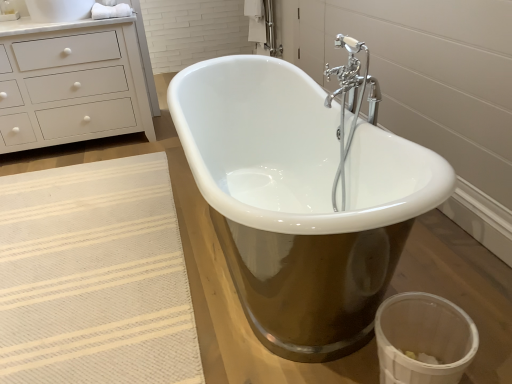
Locate an element on the screen. This screenshot has width=512, height=384. white matte chest of drawers at upper left is located at coordinates (71, 84).

What do you see at coordinates (71, 84) in the screenshot? I see `white matte chest of drawers at upper left` at bounding box center [71, 84].

Find the location of a particular element. white matte chest of drawers at upper left is located at coordinates (71, 84).

Which is more to the left, beige woven rug at lower left or white glossy bathtub at center?

Positioned to the left is beige woven rug at lower left.

Is beige woven rug at lower left positioned before white glossy bathtub at center?

No, beige woven rug at lower left is further to the viewer.

Is beige woven rug at lower left positioned far away from white glossy bathtub at center?

That's not correct — beige woven rug at lower left is a little close to white glossy bathtub at center.

Which is behind, point (366, 338) or point (441, 344)?

Positioned behind is point (366, 338).

The image size is (512, 384). Find the location of `bathtub in front of the transparent plastic toilet bowl at lower right`. bathtub in front of the transparent plastic toilet bowl at lower right is located at coordinates (300, 200).

Is white glossy bathtub at center thinner than transparent plastic toilet bowl at lower right?

Incorrect, the width of white glossy bathtub at center is not less than that of transparent plastic toilet bowl at lower right.

Can you see white glossy bathtub at center touching transparent plastic toilet bowl at lower right?

white glossy bathtub at center is not next to transparent plastic toilet bowl at lower right, and they're not touching.

Who is smaller, transparent plastic toilet bowl at lower right or white cotton towel at upper left?

white cotton towel at upper left.

Considering the sizes of objects transparent plastic toilet bowl at lower right and white cotton towel at upper left in the image provided, who is shorter, transparent plastic toilet bowl at lower right or white cotton towel at upper left?

With less height is white cotton towel at upper left.

Is transparent plastic toilet bowl at lower right turned away from white cotton towel at upper left?

transparent plastic toilet bowl at lower right does not have its back to white cotton towel at upper left.

How distant is white cotton towel at upper left from transparent plastic toilet bowl at lower right?

white cotton towel at upper left is 8.01 feet from transparent plastic toilet bowl at lower right.

Is white cotton towel at upper left aimed at transparent plastic toilet bowl at lower right?

No, white cotton towel at upper left does not turn towards transparent plastic toilet bowl at lower right.

Who is taller, white cotton towel at upper left or transparent plastic toilet bowl at lower right?

transparent plastic toilet bowl at lower right is taller.

How different are the orientations of white cotton towel at upper left and transparent plastic toilet bowl at lower right in degrees?

The angle between the facing direction of white cotton towel at upper left and the facing direction of transparent plastic toilet bowl at lower right is 89.7 degrees.

Would you say white matte chest of drawers at upper left is outside white cotton towel at upper left?

white matte chest of drawers at upper left lies outside white cotton towel at upper left's area.

The image size is (512, 384). I want to click on toilet paper that appears behind the white matte chest of drawers at upper left, so click(110, 11).

How different are the orientations of white matte chest of drawers at upper left and white cotton towel at upper left in degrees?

0.753 degrees.

From the image's perspective, is white matte chest of drawers at upper left located above or below white cotton towel at upper left?

From the image's perspective, white matte chest of drawers at upper left appears below white cotton towel at upper left.

Locate an element on the screen. bathtub that appears on the right of white cotton towel at upper left is located at coordinates (300, 200).

Can we say white cotton towel at upper left lies outside white glossy bathtub at center?

white cotton towel at upper left lies outside white glossy bathtub at center's area.

Is white cotton towel at upper left further to the viewer compared to white glossy bathtub at center?

Yes.

Between white cotton towel at upper left and white glossy bathtub at center, which one has smaller size?

white cotton towel at upper left.

From a real-world perspective, between white glossy bathtub at center and white matte chest of drawers at upper left, who is vertically higher?

white matte chest of drawers at upper left, from a real-world perspective.

Does white glossy bathtub at center have a greater height compared to white matte chest of drawers at upper left?

In fact, white glossy bathtub at center may be shorter than white matte chest of drawers at upper left.

Is white glossy bathtub at center wider or thinner than white matte chest of drawers at upper left?

Clearly, white glossy bathtub at center has more width compared to white matte chest of drawers at upper left.

How different are the orientations of white glossy bathtub at center and white matte chest of drawers at upper left in degrees?

There is a 1.14-degree angle between the facing directions of white glossy bathtub at center and white matte chest of drawers at upper left.

Locate an element on the screen. This screenshot has width=512, height=384. bath mat on the left of white glossy bathtub at center is located at coordinates (94, 277).

What are the coordinates of `toilet bowl above the white glossy bathtub at center (from a real-world perspective)` in the screenshot? It's located at (423, 339).

Which object lies further to the anchor point white glossy bathtub at center, transparent plastic toilet bowl at lower right or beige woven rug at lower left?

Among the two, beige woven rug at lower left is located further to white glossy bathtub at center.

Looking at the image, which one is located closer to white glossy bathtub at center, beige woven rug at lower left or white cotton towel at upper left?

The object closer to white glossy bathtub at center is beige woven rug at lower left.

From the image, which object appears to be nearer to white cotton towel at upper left, white glossy bathtub at center or white matte chest of drawers at upper left?

white matte chest of drawers at upper left is positioned closer to the anchor white cotton towel at upper left.

Looking at the image, which one is located further to white cotton towel at upper left, transparent plastic toilet bowl at lower right or beige woven rug at lower left?

Among the two, transparent plastic toilet bowl at lower right is located further to white cotton towel at upper left.

When comparing their distances from white cotton towel at upper left, does white matte chest of drawers at upper left or transparent plastic toilet bowl at lower right seem closer?

white matte chest of drawers at upper left.

Estimate the real-world distances between objects in this image. Which object is further from white cotton towel at upper left, transparent plastic toilet bowl at lower right or white glossy bathtub at center?

transparent plastic toilet bowl at lower right.

Which object lies further to the anchor point transparent plastic toilet bowl at lower right, white cotton towel at upper left or beige woven rug at lower left?

white cotton towel at upper left is positioned further to the anchor transparent plastic toilet bowl at lower right.

Estimate the real-world distances between objects in this image. Which object is closer to white matte chest of drawers at upper left, white cotton towel at upper left or white glossy bathtub at center?

Among the two, white cotton towel at upper left is located nearer to white matte chest of drawers at upper left.

At what (x,y) coordinates should I click in order to perform the action: click on bath mat between white cotton towel at upper left and transparent plastic toilet bowl at lower right from top to bottom. Please return your answer as a coordinate pair (x, y). Image resolution: width=512 pixels, height=384 pixels. Looking at the image, I should click on (94, 277).

The width and height of the screenshot is (512, 384). What are the coordinates of `chest of drawers between white glossy bathtub at center and white cotton towel at upper left in the front-back direction` in the screenshot? It's located at (71, 84).

Identify the location of toilet paper located between white matte chest of drawers at upper left and transparent plastic toilet bowl at lower right in the left-right direction. This screenshot has height=384, width=512. (110, 11).

This screenshot has width=512, height=384. In order to click on bath mat between white glossy bathtub at center and white cotton towel at upper left from front to back in this screenshot , I will do `click(94, 277)`.